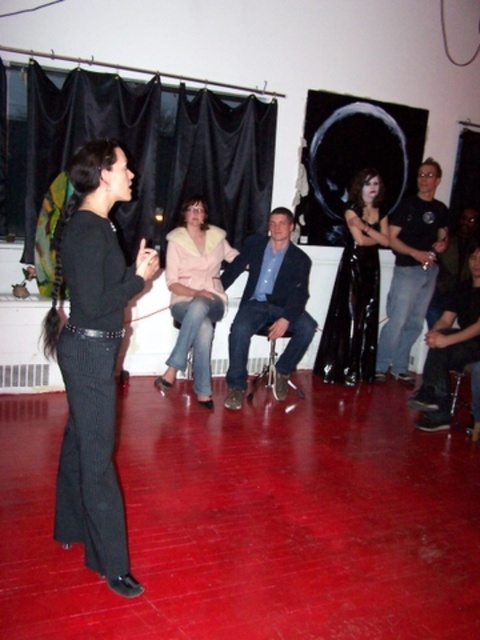
Question: Can you confirm if black leather jacket at right is positioned to the right of black leather pants at lower right?

Choices:
 (A) no
 (B) yes

Answer: (A)

Question: Can you confirm if black pinstripe pants at left is positioned to the right of black glossy dress at center?

Choices:
 (A) yes
 (B) no

Answer: (B)

Question: Is black pinstripe pants at left in front of pink fuzzy coat at center?

Choices:
 (A) no
 (B) yes

Answer: (B)

Question: Which is nearer to the black leather jacket at right?

Choices:
 (A) black glossy dress at center
 (B) black pinstripe pants at left
 (C) black leather pants at lower right

Answer: (A)

Question: Based on their relative distances, which object is farther from the pink fuzzy coat at center?

Choices:
 (A) black glossy dress at center
 (B) blue denim jeans at center

Answer: (A)

Question: Which object is positioned closest to the pink fuzzy coat at center?

Choices:
 (A) black glossy dress at center
 (B) black leather jacket at right
 (C) black leather pants at lower right
 (D) blue denim jeans at center

Answer: (D)